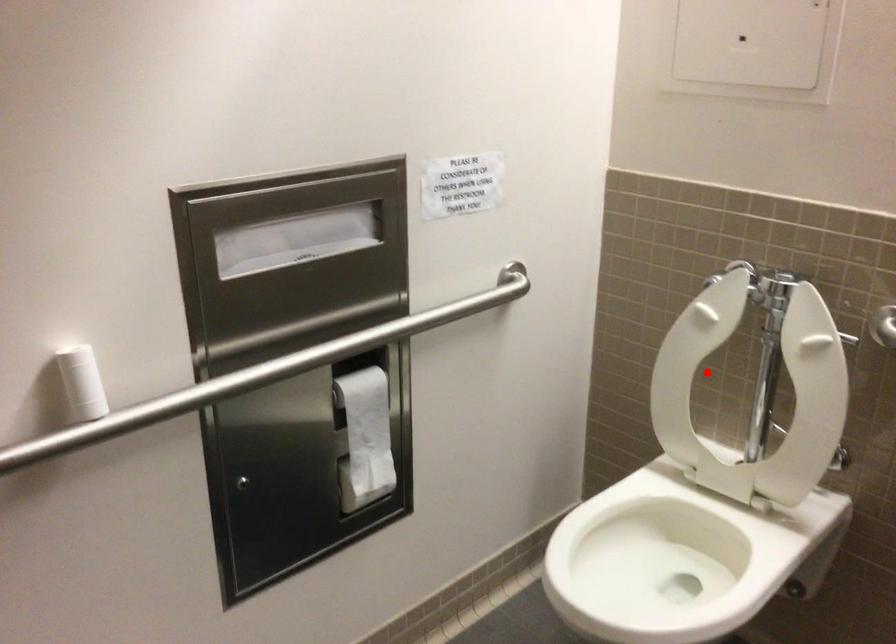
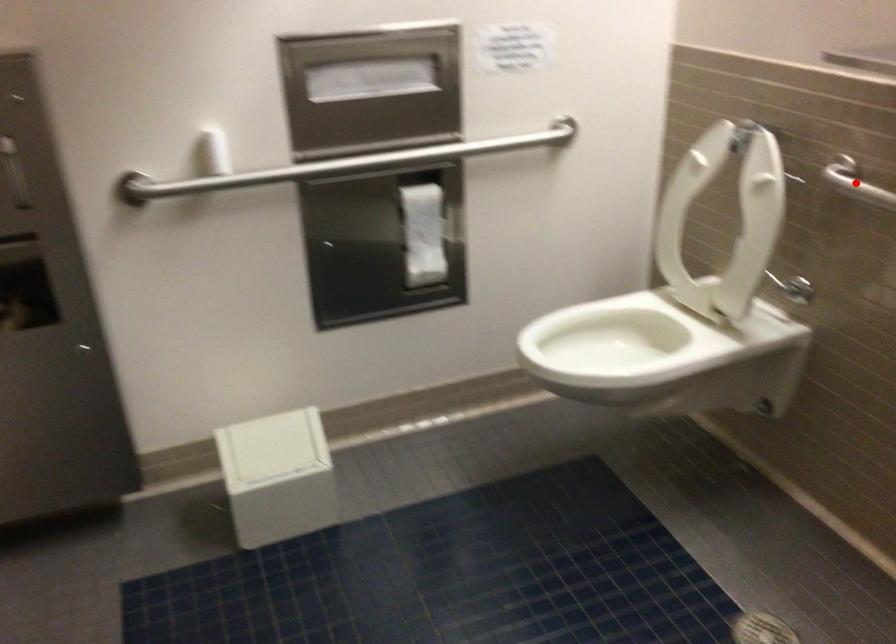
I am providing you with two images of the same scene from different viewpoints. A red point is marked on the first image and another point is marked on the second image. Are the points marked in image1 and image2 representing the same 3D position?

No